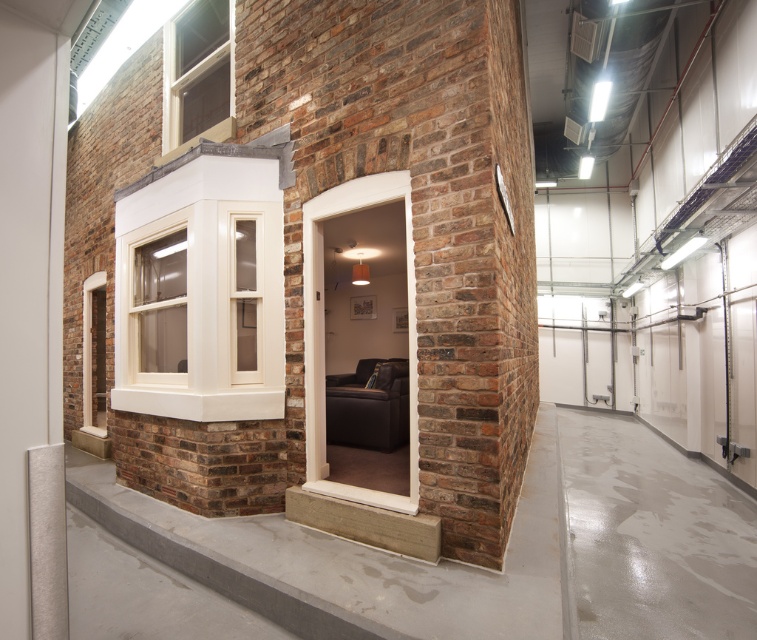
Is brown brick at center in front of matte white window at upper left?

Yes, it is in front of matte white window at upper left.

Between brown brick at center and matte white window at upper left, which one is positioned lower?

brown brick at center is below.

Does point (525, 141) lie in front of point (198, 38)?

No, (525, 141) is further to viewer.

You are a GUI agent. You are given a task and a screenshot of the screen. Output one action in this format:
    pyautogui.click(x=<x>, y=<y>)
    Task: Click on the brown brick at center
    The width and height of the screenshot is (757, 640).
    Given the screenshot: What is the action you would take?
    pyautogui.click(x=425, y=211)

Between white glossy window at upper left and white wood window at upper left, which one appears on the right side from the viewer's perspective?

From the viewer's perspective, white glossy window at upper left appears more on the right side.

Who is more forward, (248, 291) or (145, 269)?

Positioned in front is point (248, 291).

I want to click on white glossy window at upper left, so click(x=201, y=314).

Find the location of `white glossy window at upper left`. white glossy window at upper left is located at coordinates (201, 314).

Does point (203, 3) lie in front of point (139, 275)?

No, (203, 3) is further to viewer.

Between matte white window at upper left and white wood window at upper left, which one is positioned lower?

white wood window at upper left is below.

Does point (203, 22) come in front of point (185, 323)?

That is False.

What are the coordinates of `matte white window at upper left` in the screenshot? It's located at (195, 70).